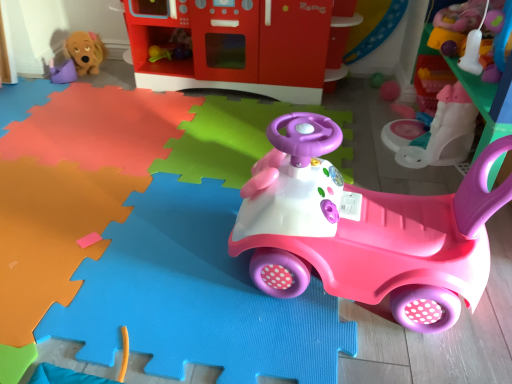
Identify the location of matte purple toy at upper left, which is the sixth toy in right-to-left order. The width and height of the screenshot is (512, 384). (63, 72).

Measure the distance between smooth plastic toy at upper right, which is the 6th toy in left-to-right order, and camera.

The distance of smooth plastic toy at upper right, which is the 6th toy in left-to-right order, from camera is 1.02 meters.

How much space does matte plastic play kitchen at upper center, which is the 4th toy from right to left, occupy vertically?

37.56 centimeters.

The image size is (512, 384). What do you see at coordinates (85, 52) in the screenshot?
I see `brown plush dog at upper left, which ranks as the 2th toy in left-to-right order` at bounding box center [85, 52].

Identify the location of matte purple toy at upper left, which is the sixth toy in right-to-left order. The image size is (512, 384). (63, 72).

Is pink plastic car at center, the third toy when ordered from right to left, far from pink plastic walker at upper right, the second toy positioned from the right?

No.

Is point (497, 207) positioned after point (476, 56)?

That is False.

Measure the distance between pink plastic car at center, which is the fourth toy from left to right, and pink plastic walker at upper right, which is counted as the fifth toy, starting from the left.

The distance of pink plastic car at center, which is the fourth toy from left to right, from pink plastic walker at upper right, which is counted as the fifth toy, starting from the left, is 49.57 centimeters.

How many degrees apart are the facing directions of pink plastic car at center, which is the fourth toy from left to right, and pink plastic walker at upper right, the second toy positioned from the right?

They differ by 85.2 degrees in their facing directions.

Does pink plastic walker at upper right, the second toy positioned from the right, have a lesser height compared to matte plastic play kitchen at upper center, which ranks as the third toy in left-to-right order?

Yes.

Does point (424, 133) come farther from viewer compared to point (300, 2)?

Yes, it is behind point (300, 2).

Could you tell me if pink plastic walker at upper right, the second toy positioned from the right, is facing matte plastic play kitchen at upper center, which is the 4th toy from right to left?

→ Yes, pink plastic walker at upper right, the second toy positioned from the right, faces towards matte plastic play kitchen at upper center, which is the 4th toy from right to left.

Which object is positioned more to the left, pink plastic walker at upper right, the second toy positioned from the right, or matte plastic play kitchen at upper center, which ranks as the third toy in left-to-right order?

Positioned to the left is matte plastic play kitchen at upper center, which ranks as the third toy in left-to-right order.

Does smooth plastic toy at upper right, which is the 6th toy in left-to-right order, have a lesser width compared to pink plastic car at center, the third toy when ordered from right to left?

In fact, smooth plastic toy at upper right, which is the 6th toy in left-to-right order, might be wider than pink plastic car at center, the third toy when ordered from right to left.

Is smooth plastic toy at upper right, placed as the first toy when sorted from right to left, situated inside pink plastic car at center, which is the fourth toy from left to right, or outside?

smooth plastic toy at upper right, placed as the first toy when sorted from right to left, is not inside pink plastic car at center, which is the fourth toy from left to right, it's outside.

Between smooth plastic toy at upper right, which is the 6th toy in left-to-right order, and pink plastic car at center, which is the fourth toy from left to right, which one appears on the right side from the viewer's perspective?

smooth plastic toy at upper right, which is the 6th toy in left-to-right order, is more to the right.

Which is in front, smooth plastic toy at upper right, which is the 6th toy in left-to-right order, or pink plastic car at center, the third toy when ordered from right to left?

pink plastic car at center, the third toy when ordered from right to left.

Based on the photo, can you confirm if smooth plastic toy at upper right, placed as the first toy when sorted from right to left, is bigger than pink plastic walker at upper right, which is counted as the fifth toy, starting from the left?

Actually, smooth plastic toy at upper right, placed as the first toy when sorted from right to left, might be smaller than pink plastic walker at upper right, which is counted as the fifth toy, starting from the left.

Image resolution: width=512 pixels, height=384 pixels. I want to click on the 1st toy above when counting from the pink plastic walker at upper right, which is counted as the fifth toy, starting from the left (from the image's perspective), so click(x=455, y=25).

From the image's perspective, which one is positioned higher, smooth plastic toy at upper right, placed as the first toy when sorted from right to left, or pink plastic walker at upper right, the second toy positioned from the right?

smooth plastic toy at upper right, placed as the first toy when sorted from right to left.

Can you tell me how much smooth plastic toy at upper right, placed as the first toy when sorted from right to left, and pink plastic walker at upper right, the second toy positioned from the right, differ in facing direction?

0.00192 degrees.

From a real-world perspective, between matte plastic play kitchen at upper center, which is the 4th toy from right to left, and brown plush dog at upper left, which ranks as the 2th toy in left-to-right order, who is vertically higher?

matte plastic play kitchen at upper center, which is the 4th toy from right to left, from a real-world perspective.

Is matte plastic play kitchen at upper center, which is the 4th toy from right to left, looking in the opposite direction of brown plush dog at upper left, which is the fifth toy from right to left?

matte plastic play kitchen at upper center, which is the 4th toy from right to left, is not turned away from brown plush dog at upper left, which is the fifth toy from right to left.

Is matte plastic play kitchen at upper center, which ranks as the third toy in left-to-right order, taller or shorter than brown plush dog at upper left, which is the fifth toy from right to left?

matte plastic play kitchen at upper center, which ranks as the third toy in left-to-right order, is taller than brown plush dog at upper left, which is the fifth toy from right to left.

Would you say brown plush dog at upper left, which is the fifth toy from right to left, is part of matte plastic play kitchen at upper center, which ranks as the third toy in left-to-right order,'s contents?

No, matte plastic play kitchen at upper center, which ranks as the third toy in left-to-right order, does not contain brown plush dog at upper left, which is the fifth toy from right to left.

Can you confirm if matte purple toy at upper left, the 1th toy when ordered from left to right, is bigger than brown plush dog at upper left, which ranks as the 2th toy in left-to-right order?

No, matte purple toy at upper left, the 1th toy when ordered from left to right, is not bigger than brown plush dog at upper left, which ranks as the 2th toy in left-to-right order.

From the image's perspective, which one is positioned lower, matte purple toy at upper left, which is the sixth toy in right-to-left order, or brown plush dog at upper left, which ranks as the 2th toy in left-to-right order?

matte purple toy at upper left, which is the sixth toy in right-to-left order, appears lower in the image.

Which of these two, matte purple toy at upper left, which is the sixth toy in right-to-left order, or brown plush dog at upper left, which is the fifth toy from right to left, is thinner?

With smaller width is matte purple toy at upper left, which is the sixth toy in right-to-left order.

From a real-world perspective, is matte purple toy at upper left, which is the sixth toy in right-to-left order, on top of brown plush dog at upper left, which ranks as the 2th toy in left-to-right order?

No, from a real-world perspective, matte purple toy at upper left, which is the sixth toy in right-to-left order, is not over brown plush dog at upper left, which ranks as the 2th toy in left-to-right order

Considering the sizes of pink plastic walker at upper right, the second toy positioned from the right, and brown plush dog at upper left, which ranks as the 2th toy in left-to-right order, in the image, is pink plastic walker at upper right, the second toy positioned from the right, taller or shorter than brown plush dog at upper left, which ranks as the 2th toy in left-to-right order,?

Considering their sizes, pink plastic walker at upper right, the second toy positioned from the right, has more height than brown plush dog at upper left, which ranks as the 2th toy in left-to-right order.

Is the position of pink plastic walker at upper right, which is counted as the fifth toy, starting from the left, less distant than that of brown plush dog at upper left, which ranks as the 2th toy in left-to-right order?

Yes, it is.

From a real-world perspective, does pink plastic walker at upper right, which is counted as the fifth toy, starting from the left, sit lower than brown plush dog at upper left, which ranks as the 2th toy in left-to-right order?

No, from a real-world perspective, pink plastic walker at upper right, which is counted as the fifth toy, starting from the left, is not beneath brown plush dog at upper left, which ranks as the 2th toy in left-to-right order.

Which of these two, pink plastic walker at upper right, which is counted as the fifth toy, starting from the left, or brown plush dog at upper left, which is the fifth toy from right to left, is smaller?

brown plush dog at upper left, which is the fifth toy from right to left.

Which toy is the 1st one when counting from the left side of the pink plastic walker at upper right, which is counted as the fifth toy, starting from the left? Please provide its 2D coordinates.

[(364, 230)]

Locate an element on the screen. the 2nd toy counting from the right of the matte plastic play kitchen at upper center, which is the 4th toy from right to left is located at coordinates (442, 132).

In the scene shown: Considering their positions, is pink plastic car at center, which is the fourth toy from left to right, positioned further to matte purple toy at upper left, which is the sixth toy in right-to-left order, than brown plush dog at upper left, which is the fifth toy from right to left?

pink plastic car at center, which is the fourth toy from left to right, is further to matte purple toy at upper left, which is the sixth toy in right-to-left order.

Based on their spatial positions, is pink plastic walker at upper right, which is counted as the fifth toy, starting from the left, or matte plastic play kitchen at upper center, which is the 4th toy from right to left, further from pink plastic car at center, which is the fourth toy from left to right?

matte plastic play kitchen at upper center, which is the 4th toy from right to left.

Looking at the image, which one is located closer to matte plastic play kitchen at upper center, which ranks as the third toy in left-to-right order, matte purple toy at upper left, which is the sixth toy in right-to-left order, or smooth plastic toy at upper right, which is the 6th toy in left-to-right order?

matte purple toy at upper left, which is the sixth toy in right-to-left order, is positioned closer to the anchor matte plastic play kitchen at upper center, which ranks as the third toy in left-to-right order.

From the picture: Looking at the image, which one is located further to smooth plastic toy at upper right, which is the 6th toy in left-to-right order, brown plush dog at upper left, which is the fifth toy from right to left, or pink plastic walker at upper right, the second toy positioned from the right?

Among the two, brown plush dog at upper left, which is the fifth toy from right to left, is located further to smooth plastic toy at upper right, which is the 6th toy in left-to-right order.

Considering their positions, is pink plastic walker at upper right, which is counted as the fifth toy, starting from the left, positioned closer to brown plush dog at upper left, which is the fifth toy from right to left, than matte plastic play kitchen at upper center, which ranks as the third toy in left-to-right order?

matte plastic play kitchen at upper center, which ranks as the third toy in left-to-right order.

When comparing their distances from brown plush dog at upper left, which ranks as the 2th toy in left-to-right order, does smooth plastic toy at upper right, placed as the first toy when sorted from right to left, or matte purple toy at upper left, which is the sixth toy in right-to-left order, seem closer?

matte purple toy at upper left, which is the sixth toy in right-to-left order, is closer to brown plush dog at upper left, which ranks as the 2th toy in left-to-right order.

Considering their positions, is brown plush dog at upper left, which ranks as the 2th toy in left-to-right order, positioned further to matte plastic play kitchen at upper center, which ranks as the third toy in left-to-right order, than pink plastic car at center, which is the fourth toy from left to right?

Based on the image, pink plastic car at center, which is the fourth toy from left to right, appears to be further to matte plastic play kitchen at upper center, which ranks as the third toy in left-to-right order.

Which object lies further to the anchor point brown plush dog at upper left, which ranks as the 2th toy in left-to-right order, pink plastic walker at upper right, the second toy positioned from the right, or smooth plastic toy at upper right, which is the 6th toy in left-to-right order?

smooth plastic toy at upper right, which is the 6th toy in left-to-right order, is further to brown plush dog at upper left, which ranks as the 2th toy in left-to-right order.

The height and width of the screenshot is (384, 512). I want to click on toy situated between matte purple toy at upper left, which is the sixth toy in right-to-left order, and matte plastic play kitchen at upper center, which is the 4th toy from right to left, from left to right, so click(x=85, y=52).

Locate an element on the screen. The image size is (512, 384). toy between pink plastic car at center, which is the fourth toy from left to right, and pink plastic walker at upper right, the second toy positioned from the right, in the front-back direction is located at coordinates (455, 25).